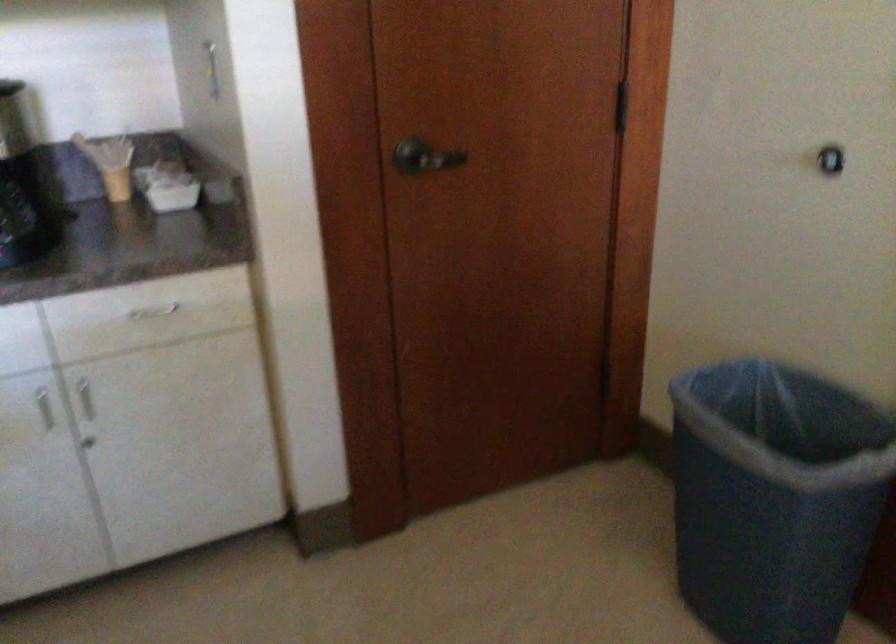
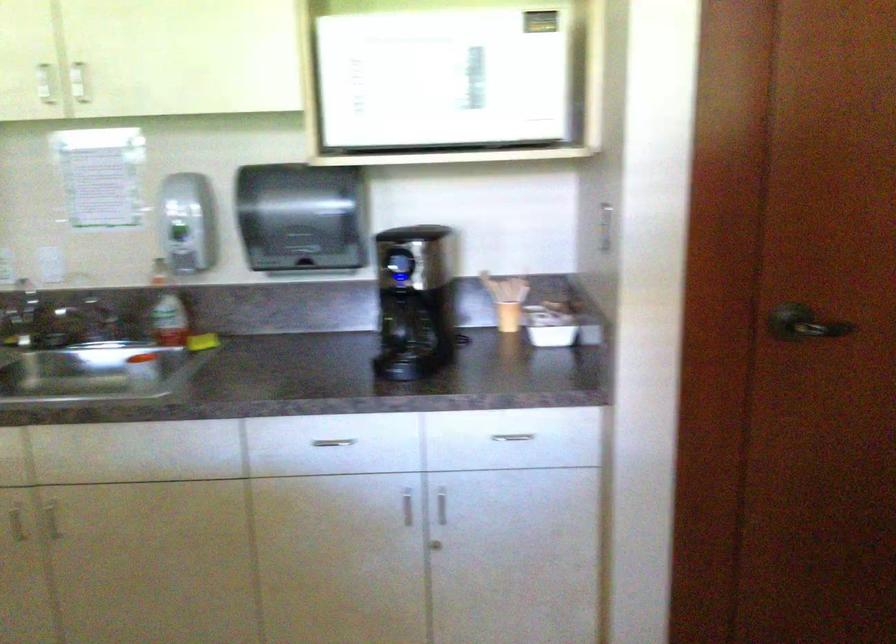
In the second image, find the point that corresponds to pixel 83 402 in the first image.

(442, 506)